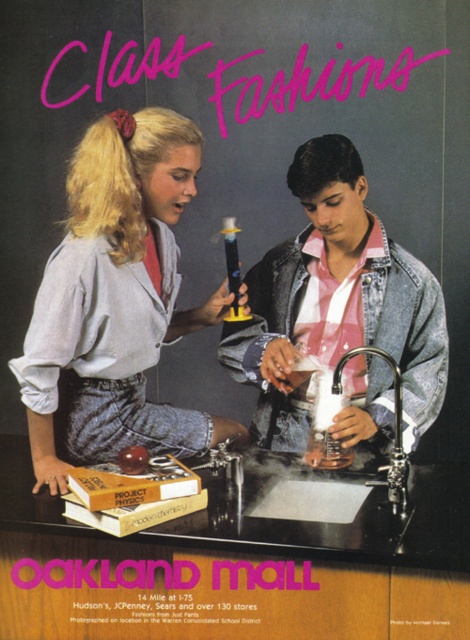
Question: Is matte blue shirt at center to the left of polished chrome faucet at lower center from the viewer's perspective?

Choices:
 (A) yes
 (B) no

Answer: (A)

Question: Which of the following is the closest to the observer?

Choices:
 (A) (420, 358)
 (B) (70, 177)

Answer: (B)

Question: Is denim jacket at center to the left of polished chrome faucet at lower center from the viewer's perspective?

Choices:
 (A) yes
 (B) no

Answer: (A)

Question: Considering the relative positions of matte blue shirt at center and polished chrome faucet at lower center in the image provided, where is matte blue shirt at center located with respect to polished chrome faucet at lower center?

Choices:
 (A) above
 (B) below

Answer: (A)

Question: Which point is farther from the camera taking this photo?

Choices:
 (A) (366, 266)
 (B) (189, 442)
 (C) (399, 483)

Answer: (B)

Question: Which is nearer to the polished chrome faucet at lower center?

Choices:
 (A) denim jacket at center
 (B) matte blue shirt at center

Answer: (A)